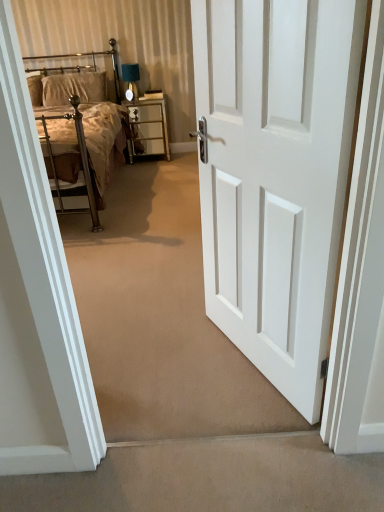
Question: In terms of width, does white painted wood door at center look wider or thinner when compared to metallic silver bed at upper left?

Choices:
 (A) wide
 (B) thin

Answer: (B)

Question: From the image's perspective, is white painted wood door at center located above or below metallic silver bed at upper left?

Choices:
 (A) above
 (B) below

Answer: (B)

Question: Estimate the real-world distances between objects in this image. Which object is closer to the beige carpet at lower center?

Choices:
 (A) metallic silver headboard at upper left
 (B) metallic gold nightstand at center
 (C) metallic silver bed at upper left
 (D) velvet beige pillow at upper left
 (E) white painted wood door at center

Answer: (E)

Question: Which is nearer to the velvet beige pillow at upper left?

Choices:
 (A) metallic silver bed at upper left
 (B) beige carpet at lower center
 (C) white painted wood door at center
 (D) metallic gold nightstand at center
 (E) metallic silver headboard at upper left

Answer: (E)